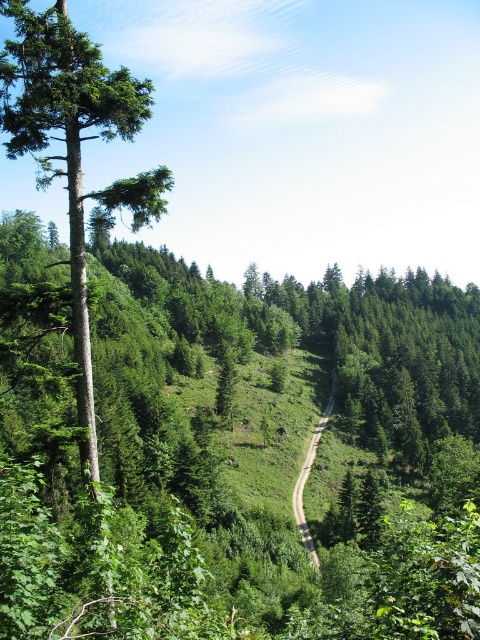
Who is lower down, green matte tree at left or dirt/path at center?

dirt/path at center is below.

Who is positioned more to the left, green matte tree at left or dirt/path at center?

green matte tree at left

Is point (127, 131) more distant than point (297, 499)?

That is False.

Locate an element on the screen. The height and width of the screenshot is (640, 480). green matte tree at left is located at coordinates (74, 150).